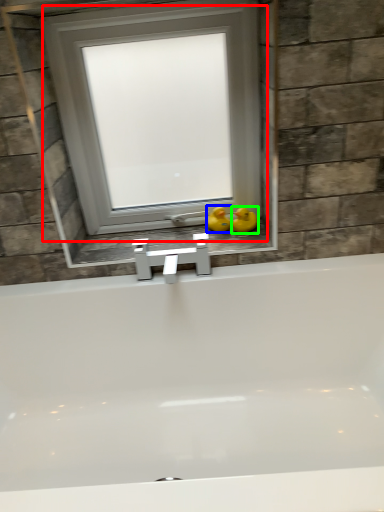
Question: Which object is positioned farthest from window (highlighted by a red box)? Select from duck (highlighted by a blue box) and duck (highlighted by a green box).

Choices:
 (A) duck
 (B) duck

Answer: (B)